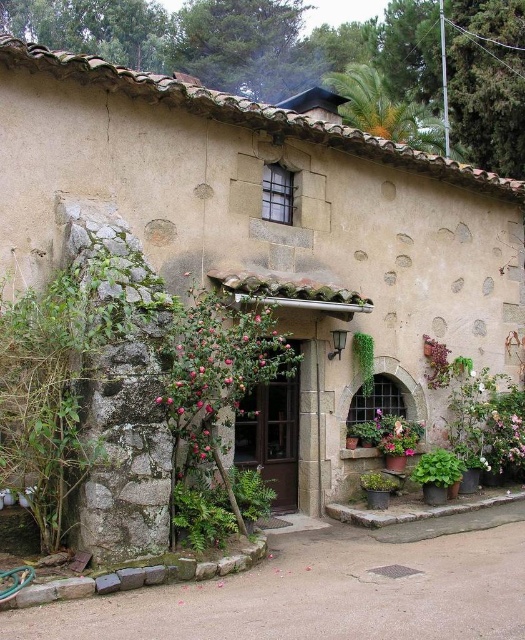
You are a gardener who needs to water both the green mossy stone wall at left and the green leafy plant at center. If your watering can holds exactly 13 feet worth of water, can you water both without refilling?

The green mossy stone wall at left and green leafy plant at center are 12.97 feet apart from each other. Since the distance is less than the watering can capacity of 13 feet, you can water both without needing to refill.

You are standing in front of the rustic building and want to determine the relative positions of two points marked on the facade. Which point, point at coordinate (79, 412) or point at coordinate (366, 333), is closer to you?

Point at coordinate (79, 412) is closer to the viewer than point at coordinate (366, 333).